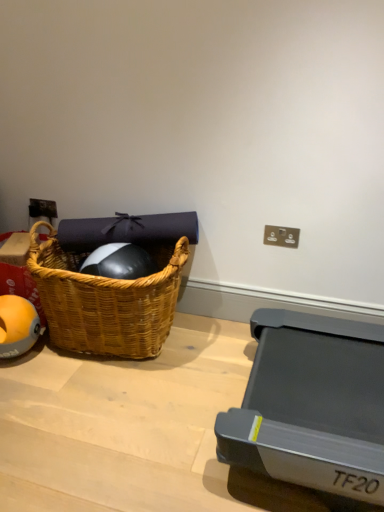
Question: Based on their sizes in the image, would you say matte plastic electric outlet at upper right is bigger or smaller than orange rubber ball at left?

Choices:
 (A) small
 (B) big

Answer: (A)

Question: Considering the positions of matte plastic electric outlet at upper right and orange rubber ball at left in the image, is matte plastic electric outlet at upper right taller or shorter than orange rubber ball at left?

Choices:
 (A) short
 (B) tall

Answer: (A)

Question: Considering the real-world distances, which object is closest to the matte plastic electric outlet at upper right?

Choices:
 (A) woven wood picnic basket at left
 (B) orange rubber ball at left

Answer: (A)

Question: Based on their relative distances, which object is nearer to the woven wood picnic basket at left?

Choices:
 (A) matte plastic electric outlet at upper right
 (B) orange rubber ball at left

Answer: (B)